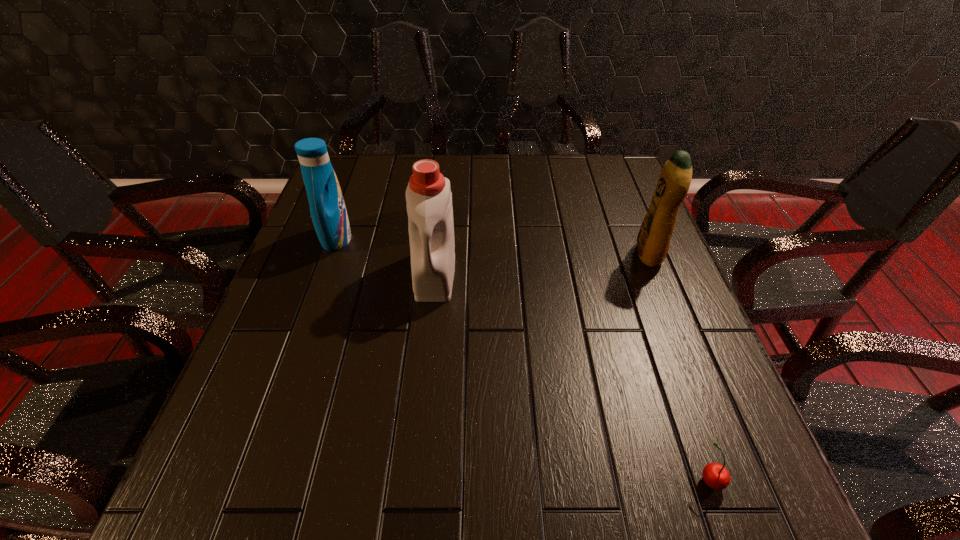
You are a GUI agent. You are given a task and a screenshot of the screen. Output one action in this format:
    pyautogui.click(x=<x>, y=<y>)
    Task: Click on the vacant space at the far left corner
    The height and width of the screenshot is (540, 960).
    Given the screenshot: What is the action you would take?
    pyautogui.click(x=372, y=157)

In order to click on free region at the near right corner in this screenshot , I will do `click(770, 497)`.

Locate an element on the screen. The width and height of the screenshot is (960, 540). vacant space in between the rightmost detergent and the shortest object is located at coordinates (680, 366).

You are a GUI agent. You are given a task and a screenshot of the screen. Output one action in this format:
    pyautogui.click(x=<x>, y=<y>)
    Task: Click on the vacant region between the leftmost detergent and the nearest object
    The image size is (960, 540).
    Given the screenshot: What is the action you would take?
    pyautogui.click(x=523, y=359)

The height and width of the screenshot is (540, 960). Identify the location of vacant space that is in between the cherry and the rightmost detergent. (680, 366).

Image resolution: width=960 pixels, height=540 pixels. In order to click on free space between the cherry and the leftmost detergent in this screenshot , I will do tap(523, 359).

Find the location of a particular element. free point between the rightmost detergent and the cherry is located at coordinates (680, 366).

Locate an element on the screen. vacant space that's between the rightmost detergent and the second detergent from left to right is located at coordinates (541, 264).

What are the coordinates of `free point between the leftmost object and the third object from right to left` in the screenshot? It's located at 386,256.

The width and height of the screenshot is (960, 540). Find the location of `free spot between the shortest object and the second object from left to right`. free spot between the shortest object and the second object from left to right is located at coordinates (573, 376).